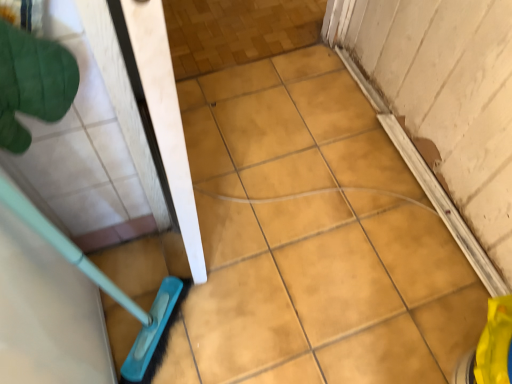
The image size is (512, 384). Find the location of `blank area beneath yellow matte tile at lower right, the first ceramic tile in the right-to-left sequence (from a real-world perspective)`. blank area beneath yellow matte tile at lower right, the first ceramic tile in the right-to-left sequence (from a real-world perspective) is located at coordinates (452, 350).